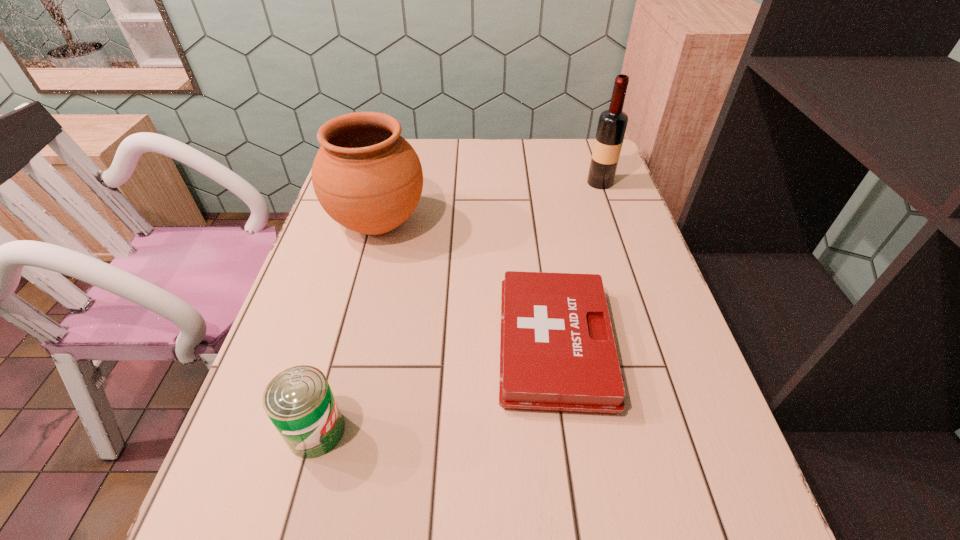
Find the location of a particular element. Image resolution: width=960 pixels, height=540 pixels. the farthest object is located at coordinates (612, 124).

I want to click on wine bottle, so click(612, 124).

Locate an element on the screen. This screenshot has width=960, height=540. pottery is located at coordinates (366, 176).

Locate an element on the screen. the third shortest object is located at coordinates (366, 176).

At what (x,y) coordinates should I click in order to perform the action: click on the third tallest object. Please return your answer as a coordinate pair (x, y). Image resolution: width=960 pixels, height=540 pixels. Looking at the image, I should click on (299, 401).

Image resolution: width=960 pixels, height=540 pixels. What are the coordinates of `the second object from right to left` in the screenshot? It's located at (557, 351).

Identify the location of the first-aid kit. The image size is (960, 540). [557, 351].

Where is `free space located on the back of the rightmost object`? free space located on the back of the rightmost object is located at coordinates (588, 150).

In order to click on vacant space located 0.190m on the right of the second farthest object in this screenshot , I will do `click(497, 224)`.

Locate an element on the screen. free space located on the back of the third tallest object is located at coordinates (330, 382).